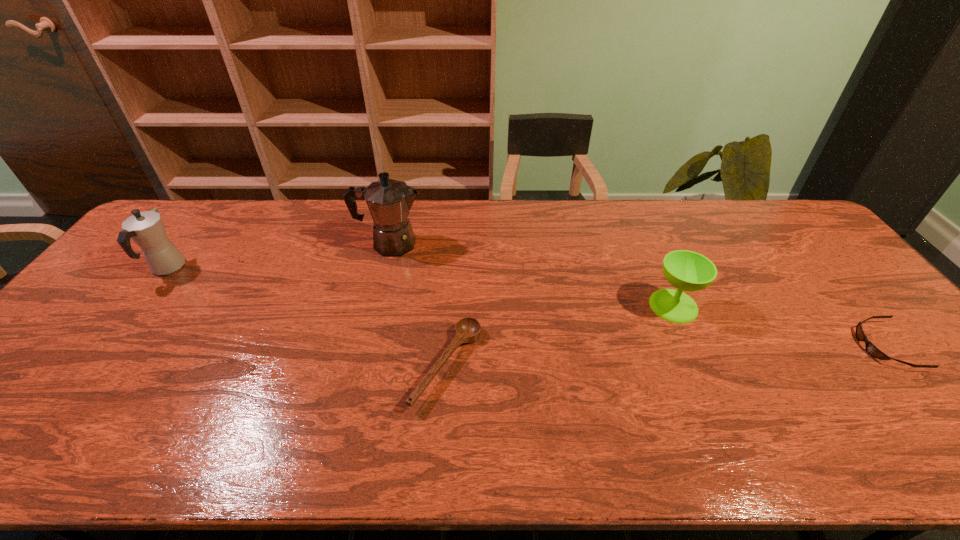
This screenshot has width=960, height=540. In order to click on the tallest object in this screenshot , I will do `click(389, 201)`.

Where is `the right coffeepot`? the right coffeepot is located at coordinates (389, 201).

I want to click on the shorter coffeepot, so click(146, 229).

Image resolution: width=960 pixels, height=540 pixels. What are the coordinates of `the second tallest object` in the screenshot? It's located at (146, 229).

What are the coordinates of `the third shortest object` in the screenshot? It's located at pos(689,271).

At what (x,y) coordinates should I click in order to perform the action: click on wineglass. Please return your answer as a coordinate pair (x, y). Image resolution: width=960 pixels, height=540 pixels. Looking at the image, I should click on (689, 271).

Identify the location of wooden spoon. This screenshot has width=960, height=540. (467, 330).

Locate an element on the screen. the third object from right to left is located at coordinates (467, 330).

At what (x,y) coordinates should I click in order to perform the action: click on the shortest object. Please return your answer as a coordinate pair (x, y). Looking at the image, I should click on (870, 348).

What are the coordinates of `the rightmost object` in the screenshot? It's located at (870, 348).